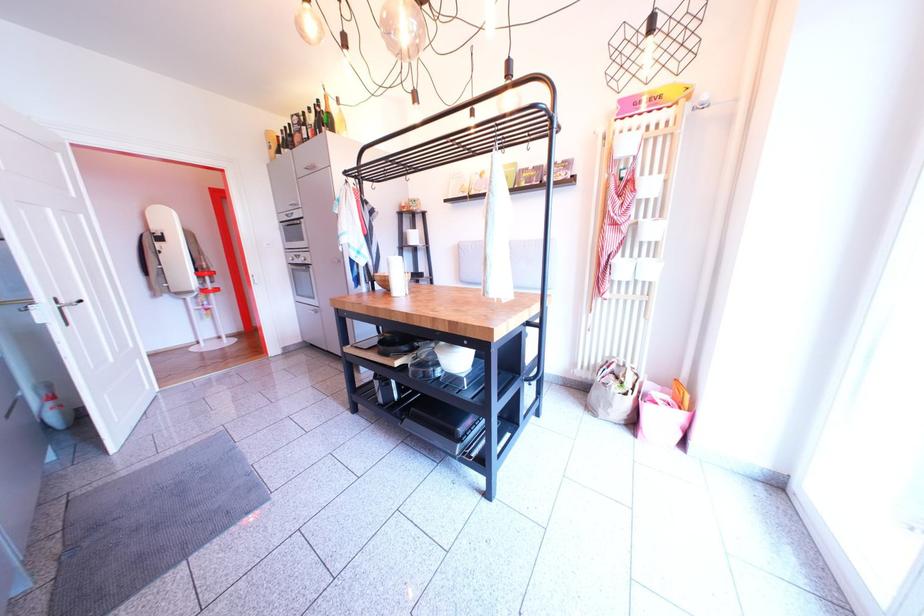
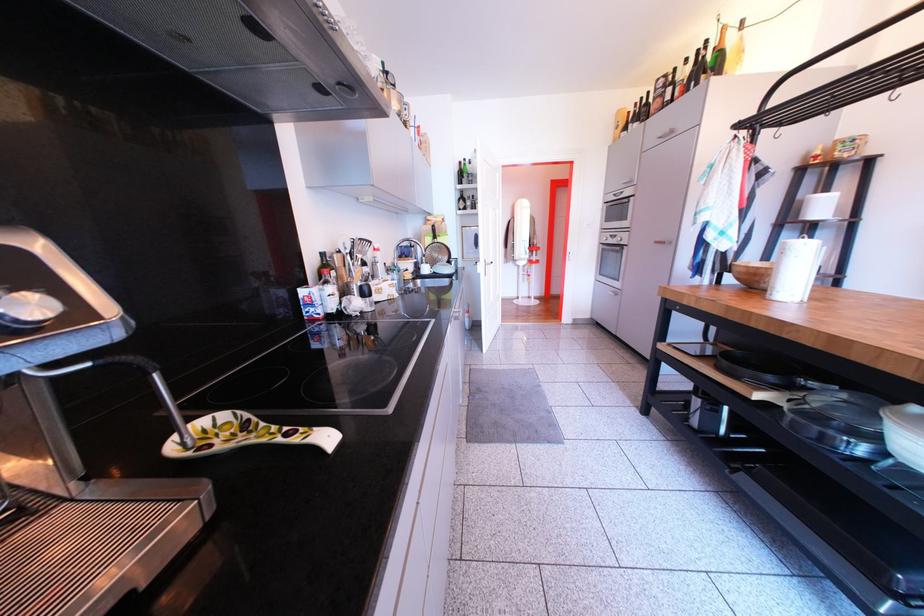
Locate, in the second image, the point that corresponds to the point at 379,185 in the first image.

(782, 132)